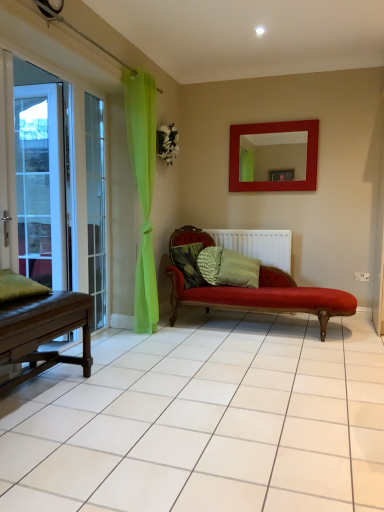
The height and width of the screenshot is (512, 384). In order to click on vacant space situated above matte red mirror at upper center (from a real-world perspective) in this screenshot , I will do `click(278, 117)`.